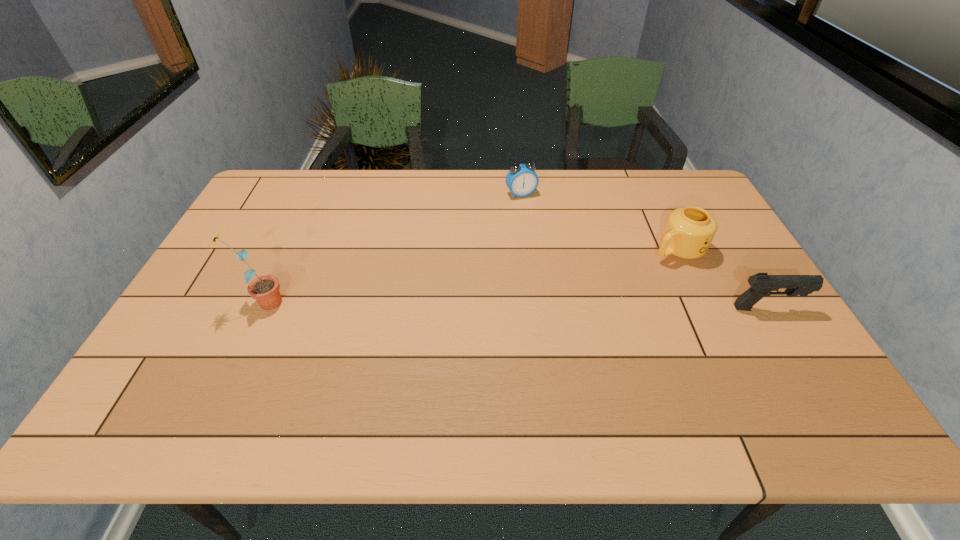
You are a GUI agent. You are given a task and a screenshot of the screen. Output one action in this format:
    pyautogui.click(x=<x>, y=<y>)
    Task: Click on the sunflower
    
    Given the screenshot: What is the action you would take?
    pyautogui.click(x=265, y=289)

Find the location of a particular element. the tallest object is located at coordinates (265, 289).

The width and height of the screenshot is (960, 540). Find the location of `pistol`. pistol is located at coordinates (762, 284).

Identify the location of mug. This screenshot has width=960, height=540. (689, 231).

Image resolution: width=960 pixels, height=540 pixels. I want to click on the farthest object, so click(x=521, y=180).

The height and width of the screenshot is (540, 960). What are the coordinates of `the second object from left to right` in the screenshot? It's located at (521, 180).

Locate an element on the screen. The image size is (960, 540). vacant area situated 0.400m on the flower of the tallest object is located at coordinates (436, 303).

You are a GUI agent. You are given a task and a screenshot of the screen. Output one action in this format:
    pyautogui.click(x=<x>, y=<y>)
    Task: Click on the vacant space located on the handle side of the mug
    The width and height of the screenshot is (960, 540).
    Given the screenshot: What is the action you would take?
    pyautogui.click(x=596, y=293)

I want to click on vacant space positioned on the handle side of the mug, so click(x=622, y=278).

Identify the location of vacant space located 0.180m on the handle side of the mug. The height and width of the screenshot is (540, 960). (614, 282).